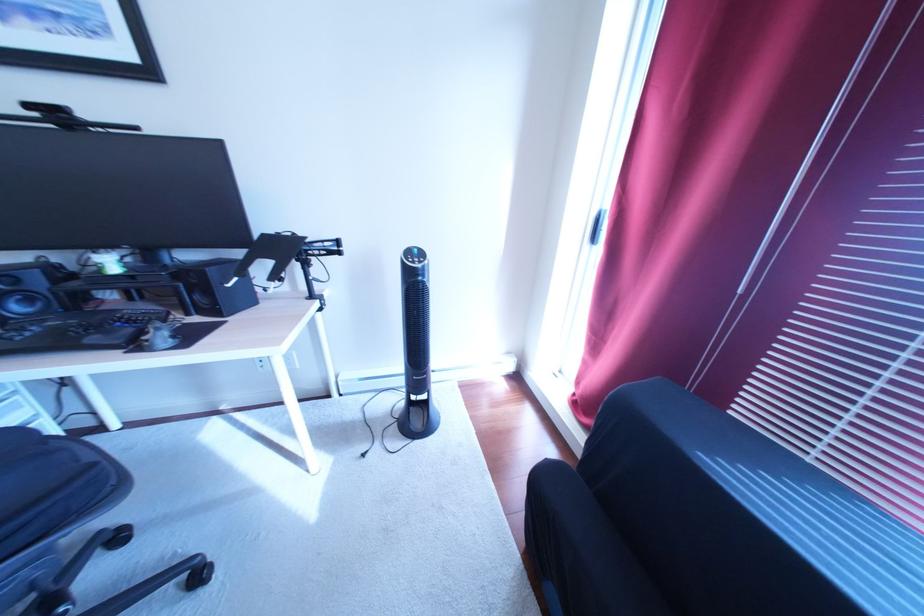
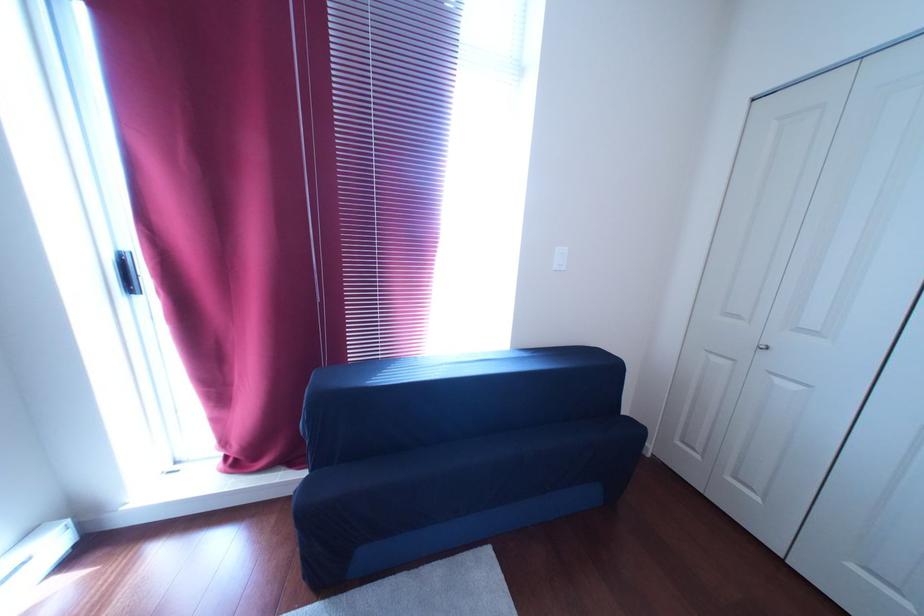
The first image is from the beginning of the video and the second image is from the end. How did the camera likely rotate when shooting the video?

The rotation direction of the camera is right-down.